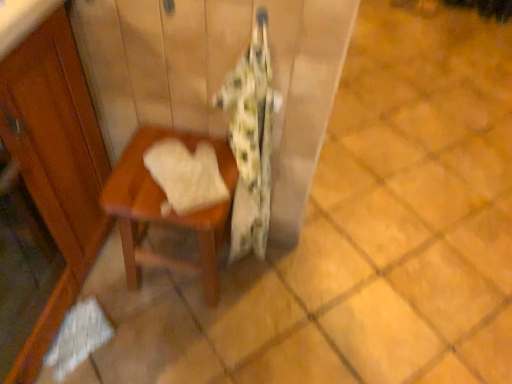
The image size is (512, 384). In order to click on free space to the right of wooden table at center in this screenshot , I will do `click(272, 300)`.